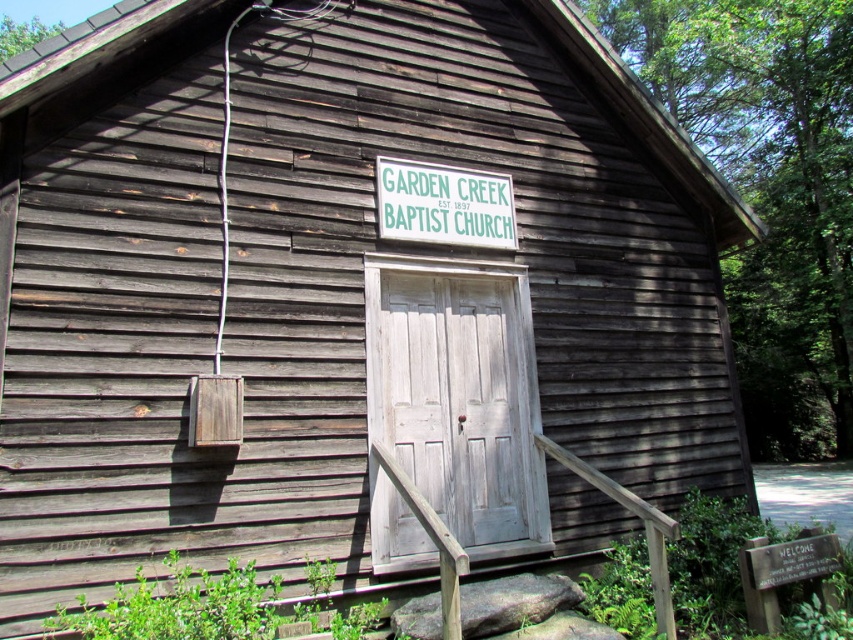
You are standing in front of the Garden Creek Baptist Church and want to enter. The door is to the right of the sign. Which direction should you move relative to the green wooden sign at center to reach the white wood door at center?

The white wood door at center is located to the right of the green wooden sign at center, so you should move to the right of the green wooden sign at center to reach the door.

You are standing at the entrance of the Garden Creek Baptist Church and want to take a photo of the point at coordinate point (375, 506). If your camera has a maximum focus range of 5 meters, will it be able to focus on that point?

The distance of point (375, 506) from the camera is 4.83 meters, which is within the camera maximum focus range of 5 meters. So the camera can focus on that point.